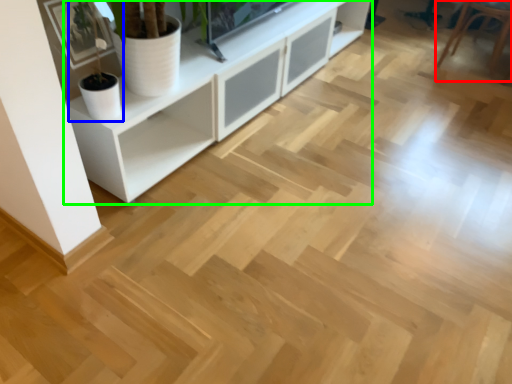
Question: Considering the real-world distances, which object is farthest from armchair (highlighted by a red box)? houseplant (highlighted by a blue box) or cabinetry (highlighted by a green box)?

Choices:
 (A) houseplant
 (B) cabinetry

Answer: (A)